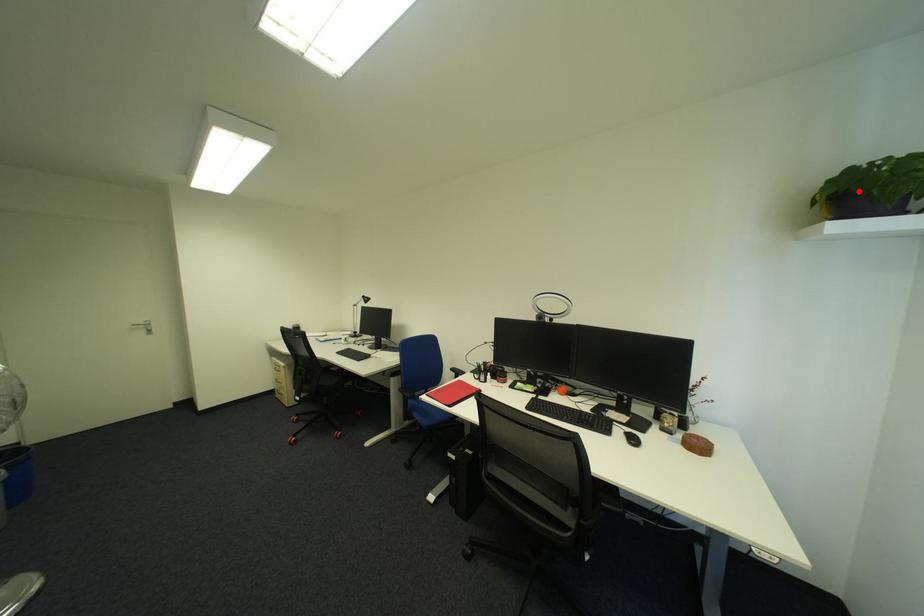
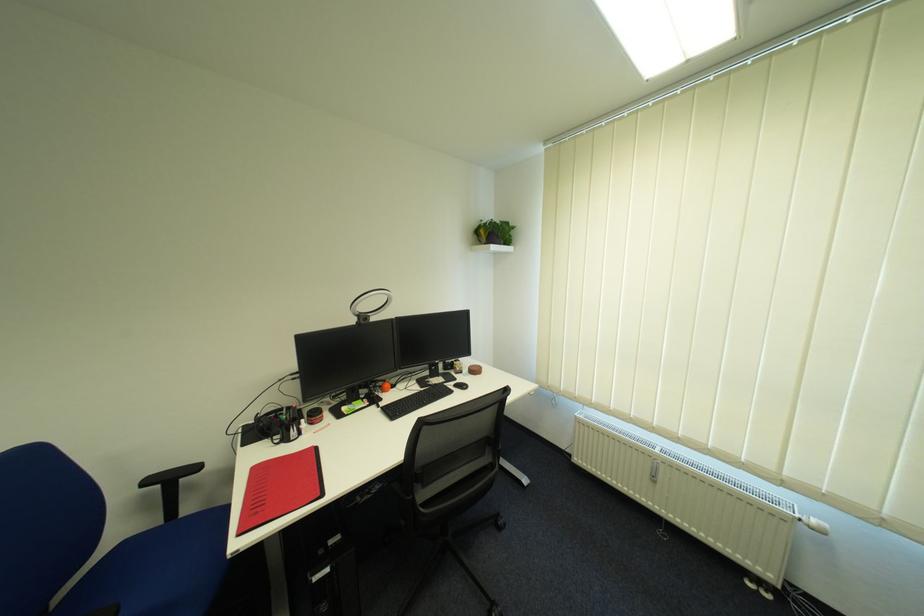
Locate, in the second image, the point that corresponds to the highlighted location in the first image.

(503, 233)